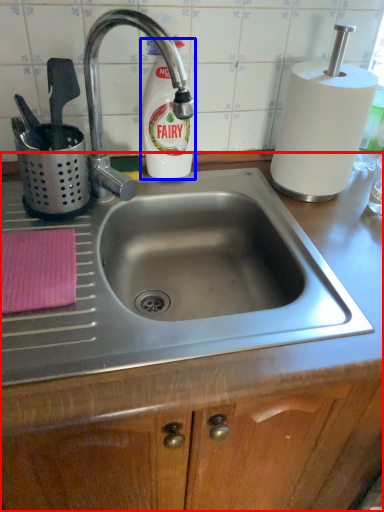
Question: Which point is further to the camera, counter (highlighted by a red box) or cleaning product (highlighted by a blue box)?

Choices:
 (A) counter
 (B) cleaning product

Answer: (B)